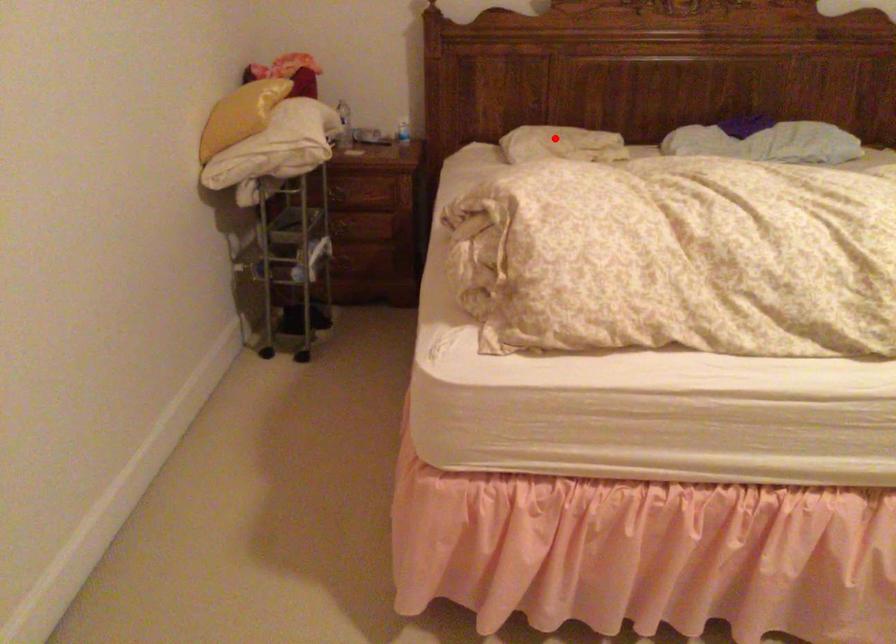
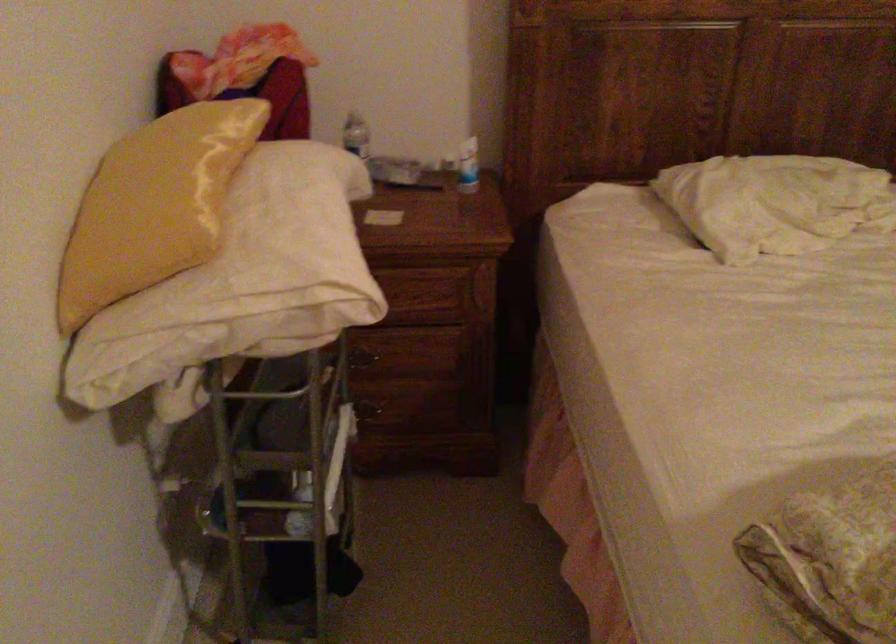
Question: I am providing you with two images of the same scene from different viewpoints. A red point is shown in image1. For the corresponding object point in image2, is it positioned nearer or farther from the camera?

Choices:
 (A) Nearer
 (B) Farther

Answer: (A)